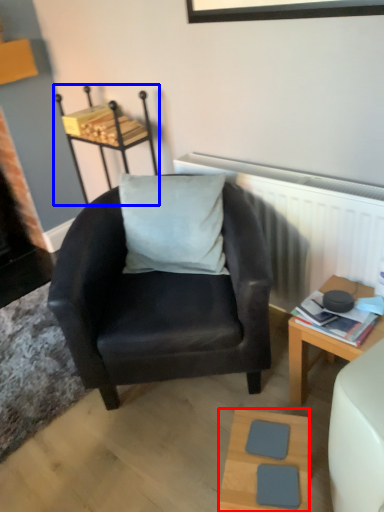
Question: Which object is further to the camera taking this photo, table (highlighted by a red box) or stool (highlighted by a blue box)?

Choices:
 (A) table
 (B) stool

Answer: (B)